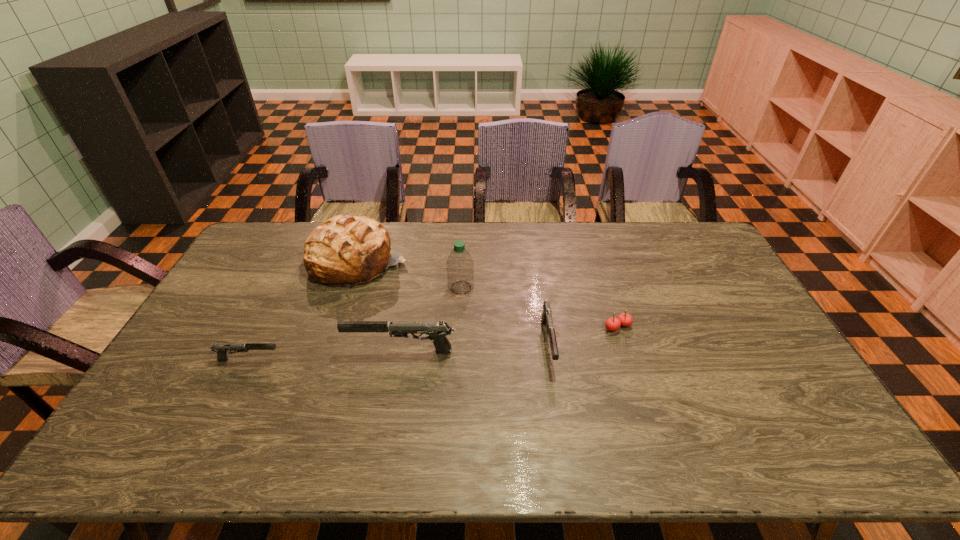
At what (x,y) coordinates should I click in order to perform the action: click on free point that keeps the guns evenly spaced on the right. Please return your answer as a coordinate pair (x, y). Looking at the image, I should click on (690, 335).